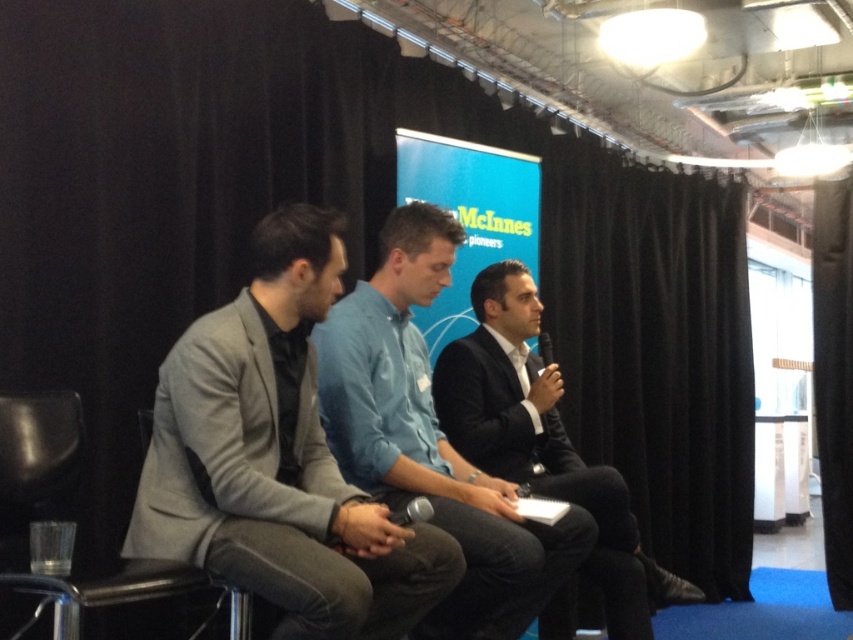
Question: Which point is closer to the camera?

Choices:
 (A) (361, 612)
 (B) (585, 548)

Answer: (A)

Question: Which point appears farthest from the camera in this image?

Choices:
 (A) (721, 321)
 (B) (595, 579)

Answer: (A)

Question: Is light blue denim shirt at center bigger than black suit at center?

Choices:
 (A) no
 (B) yes

Answer: (A)

Question: Is black suit at center positioned in front of black fabric curtain at right?

Choices:
 (A) no
 (B) yes

Answer: (B)

Question: Estimate the real-world distances between objects in this image. Which object is closer to the black suit at center?

Choices:
 (A) gray suit at left
 (B) black velvet curtain at upper center
 (C) black fabric curtain at right

Answer: (A)

Question: Does black velvet curtain at upper center appear under black leather chair at left?

Choices:
 (A) no
 (B) yes

Answer: (A)